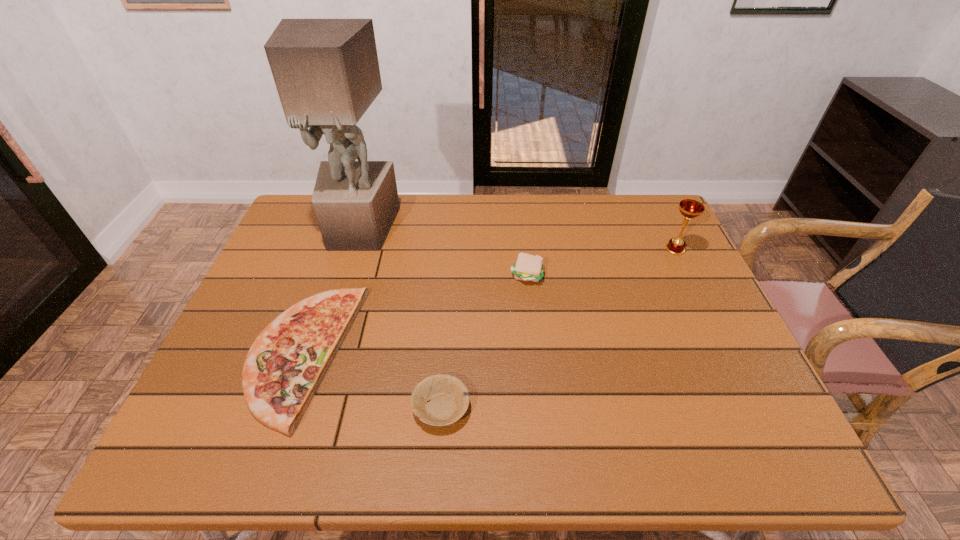
You are a GUI agent. You are given a task and a screenshot of the screen. Output one action in this format:
    pyautogui.click(x=<x>, y=<y>)
    Task: Click on the free space located on the front of the third nearest object
    The image size is (960, 540).
    Given the screenshot: What is the action you would take?
    pyautogui.click(x=536, y=352)

Identify the location of vacant region located on the right of the pizza. The width and height of the screenshot is (960, 540). (399, 355).

You are a GUI agent. You are given a task and a screenshot of the screen. Output one action in this format:
    pyautogui.click(x=<x>, y=<y>)
    Task: Click on the free space located 0.100m on the back of the shortest object
    This screenshot has width=960, height=540.
    Given the screenshot: What is the action you would take?
    pyautogui.click(x=445, y=348)

The width and height of the screenshot is (960, 540). I want to click on object present at the far edge, so click(326, 71).

At what (x,y) coordinates should I click in order to perform the action: click on pizza at the near edge. Please return your answer as a coordinate pair (x, y). Looking at the image, I should click on (286, 363).

In order to click on bowl at the near edge in this screenshot , I will do `click(448, 398)`.

The image size is (960, 540). What are the coordinates of `sculpture that is at the left edge` in the screenshot? It's located at (326, 71).

I want to click on pizza situated at the left edge, so click(286, 363).

The image size is (960, 540). I want to click on object located in the right edge section of the desktop, so click(689, 208).

Find the location of `object that is at the far left corner`. object that is at the far left corner is located at coordinates (326, 71).